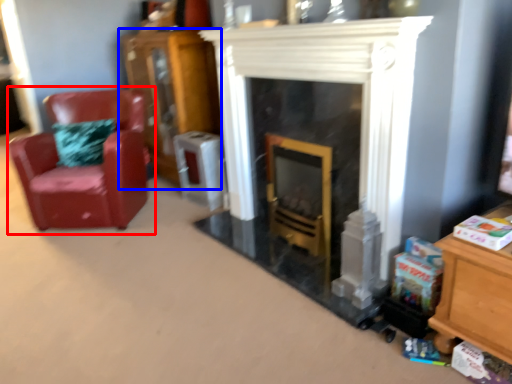
Question: Which object appears closest to the camera in this image, chair (highlighted by a red box) or dresser (highlighted by a blue box)?

Choices:
 (A) chair
 (B) dresser

Answer: (A)